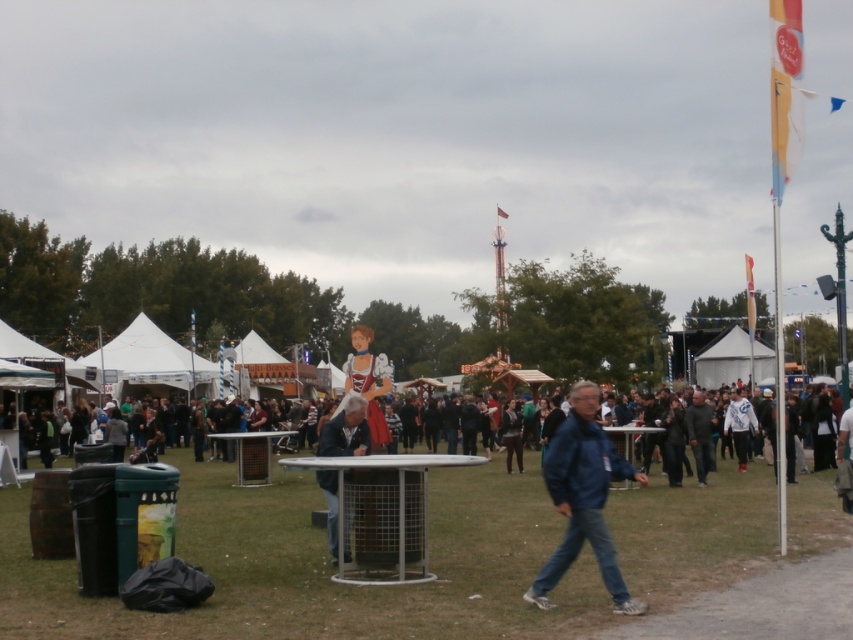
Question: Which point is farther to the camera?

Choices:
 (A) (332, 502)
 (B) (695, 448)

Answer: (B)

Question: Is blue denim jacket at center closer to camera compared to dark gray jacket at center?

Choices:
 (A) yes
 (B) no

Answer: (A)

Question: Does denim jacket at center have a larger size compared to dark gray jacket at center?

Choices:
 (A) yes
 (B) no

Answer: (B)

Question: Which is farther from the denim jacket at center?

Choices:
 (A) dark gray jacket at center
 (B) blue denim jacket at center

Answer: (A)

Question: Which point is farther to the camera?

Choices:
 (A) (689, 404)
 (B) (337, 508)

Answer: (A)

Question: Does blue denim jacket at center have a larger size compared to dark gray jacket at center?

Choices:
 (A) no
 (B) yes

Answer: (B)